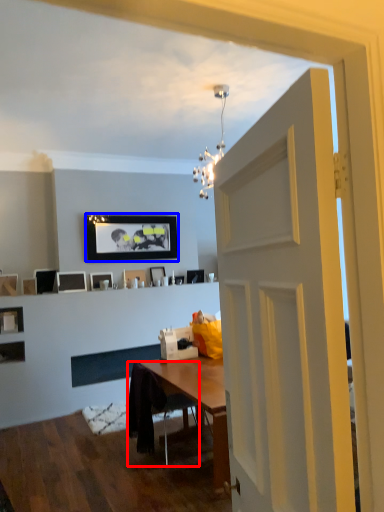
Question: Among these objects, which one is farthest to the camera, chair (highlighted by a red box) or picture frame (highlighted by a blue box)?

Choices:
 (A) chair
 (B) picture frame

Answer: (B)